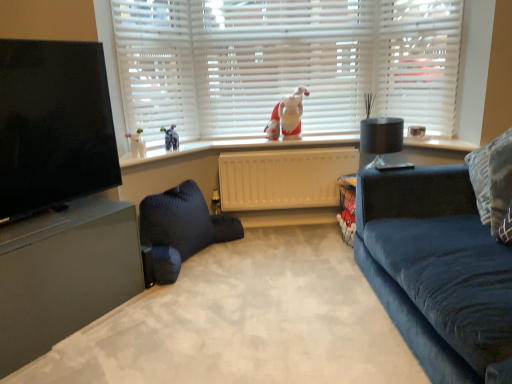
Locate an element on the screen. vacant area on top of white plastic radiator at center (from a real-world perspective) is located at coordinates (293, 150).